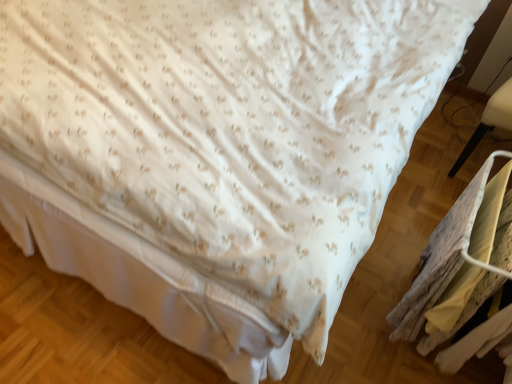
What is the approximate width of white plastic chair at right?

white plastic chair at right is 25.46 inches wide.

What do you see at coordinates (489, 121) in the screenshot? I see `white plastic chair at right` at bounding box center [489, 121].

Locate an element on the screen. This screenshot has height=384, width=512. white plastic chair at right is located at coordinates (489, 121).

Measure the distance between yellow fabric laundry at lower right and camera.

The depth of yellow fabric laundry at lower right is 3.36 feet.

Describe the element at coordinates (456, 263) in the screenshot. I see `yellow fabric laundry at lower right` at that location.

The height and width of the screenshot is (384, 512). I want to click on yellow fabric laundry at lower right, so click(x=456, y=263).

The width and height of the screenshot is (512, 384). Identify the location of white plastic chair at right. (489, 121).

Is white plastic chair at right at the left side of yellow fabric laundry at lower right?

No, white plastic chair at right is not to the left of yellow fabric laundry at lower right.

Is the position of white plastic chair at right less distant than that of yellow fabric laundry at lower right?

That is False.

Is point (480, 123) farther from viewer compared to point (450, 237)?

Yes, it is.

From the image's perspective, is white plastic chair at right below yellow fabric laundry at lower right?

No, from the image's perspective, white plastic chair at right is not beneath yellow fabric laundry at lower right.

In the scene shown: From a real-world perspective, between white plastic chair at right and yellow fabric laundry at lower right, who is vertically higher?

white plastic chair at right.

Does white plastic chair at right have a greater width compared to yellow fabric laundry at lower right?

Correct, the width of white plastic chair at right exceeds that of yellow fabric laundry at lower right.

Can you confirm if white plastic chair at right is taller than yellow fabric laundry at lower right?

Yes, white plastic chair at right is taller than yellow fabric laundry at lower right.

Between white plastic chair at right and yellow fabric laundry at lower right, which one has larger size?

With larger size is white plastic chair at right.

Which is correct: white plastic chair at right is inside yellow fabric laundry at lower right, or outside of it?

white plastic chair at right is not enclosed by yellow fabric laundry at lower right.

Is white plastic chair at right beside yellow fabric laundry at lower right?

No, white plastic chair at right is not in contact with yellow fabric laundry at lower right.

Is white plastic chair at right facing towards yellow fabric laundry at lower right?

Yes, white plastic chair at right is facing yellow fabric laundry at lower right.

What's the angular difference between white plastic chair at right and yellow fabric laundry at lower right's facing directions?

88 degrees separate the facing orientations of white plastic chair at right and yellow fabric laundry at lower right.

Where is `laundry to the left of white plastic chair at right`? The width and height of the screenshot is (512, 384). laundry to the left of white plastic chair at right is located at coordinates (456, 263).

Is yellow fabric laundry at lower right to the left or to the right of white plastic chair at right in the image?

Based on their positions, yellow fabric laundry at lower right is located to the left of white plastic chair at right.

Is the depth of yellow fabric laundry at lower right less than that of white plastic chair at right?

Yes, it is.

Is point (450, 273) less distant than point (504, 104)?

Yes, point (450, 273) is closer to viewer.

From the image's perspective, which one is positioned lower, yellow fabric laundry at lower right or white plastic chair at right?

yellow fabric laundry at lower right.

From a real-world perspective, who is located higher, yellow fabric laundry at lower right or white plastic chair at right?

From a 3D spatial view, white plastic chair at right is above.

Considering the sizes of yellow fabric laundry at lower right and white plastic chair at right in the image, is yellow fabric laundry at lower right wider or thinner than white plastic chair at right?

In the image, yellow fabric laundry at lower right appears to be more narrow than white plastic chair at right.

Between yellow fabric laundry at lower right and white plastic chair at right, which one has less height?

yellow fabric laundry at lower right.

Is yellow fabric laundry at lower right smaller than white plastic chair at right?

Indeed, yellow fabric laundry at lower right has a smaller size compared to white plastic chair at right.

Is yellow fabric laundry at lower right inside the boundaries of white plastic chair at right, or outside?

yellow fabric laundry at lower right cannot be found inside white plastic chair at right.

Is there a large distance between yellow fabric laundry at lower right and white plastic chair at right?

No, there isn't a large distance between yellow fabric laundry at lower right and white plastic chair at right.

Is yellow fabric laundry at lower right positioned with its back to white plastic chair at right?

yellow fabric laundry at lower right does not have its back to white plastic chair at right.

What's the angular difference between yellow fabric laundry at lower right and white plastic chair at right's facing directions?

The angular difference between yellow fabric laundry at lower right and white plastic chair at right is 88 degrees.

How much distance is there between yellow fabric laundry at lower right and white plastic chair at right?

yellow fabric laundry at lower right is 27.71 inches from white plastic chair at right.

Where is `laundry in front of the white plastic chair at right`? This screenshot has height=384, width=512. laundry in front of the white plastic chair at right is located at coordinates (456, 263).

Find the location of a particular element. The height and width of the screenshot is (384, 512). furniture located above the yellow fabric laundry at lower right (from a real-world perspective) is located at coordinates (489, 121).

This screenshot has width=512, height=384. What are the coordinates of `laundry in front of the white plastic chair at right` in the screenshot? It's located at (456, 263).